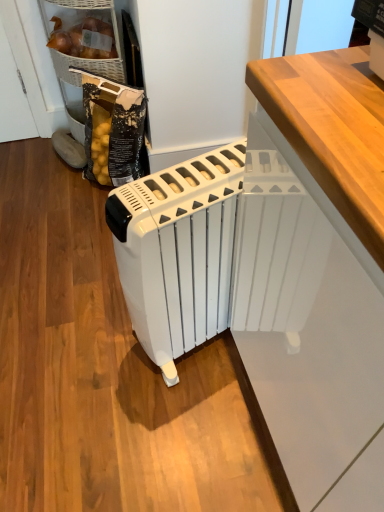
Question: From a real-world perspective, is matte wicker basket at upper left, placed as the 2th cabinetry when sorted from bottom to top, under white glossy radiator at center, the first cabinetry viewed from the front?

Choices:
 (A) yes
 (B) no

Answer: (B)

Question: Does matte wicker basket at upper left, acting as the first cabinetry starting from the top, lie in front of white glossy radiator at center, the 2th cabinetry from the back?

Choices:
 (A) yes
 (B) no

Answer: (B)

Question: From a real-world perspective, is matte wicker basket at upper left, the 2th cabinetry when ordered from front to back, on top of white glossy radiator at center, which is the first cabinetry from bottom to top?

Choices:
 (A) no
 (B) yes

Answer: (B)

Question: Is there a large distance between matte wicker basket at upper left, the 2th cabinetry when ordered from front to back, and white glossy radiator at center, which ranks as the 2th cabinetry in left-to-right order?

Choices:
 (A) no
 (B) yes

Answer: (B)

Question: Is matte wicker basket at upper left, placed as the 2th cabinetry when sorted from bottom to top, to the right of white glossy radiator at center, which ranks as the 2th cabinetry in left-to-right order, from the viewer's perspective?

Choices:
 (A) no
 (B) yes

Answer: (A)

Question: Is matte wicker basket at upper left, acting as the first cabinetry starting from the top, outside of white glossy radiator at center, the 2th cabinetry in the top-to-bottom sequence?

Choices:
 (A) no
 (B) yes

Answer: (B)

Question: Can you confirm if white glossy radiator at center, the first cabinetry when ordered from right to left, is smaller than matte wicker basket at upper left, acting as the first cabinetry starting from the top?

Choices:
 (A) yes
 (B) no

Answer: (B)

Question: Is white glossy radiator at center, which ranks as the 2th cabinetry in left-to-right order, next to matte wicker basket at upper left, the 2th cabinetry in the right-to-left sequence?

Choices:
 (A) no
 (B) yes

Answer: (A)

Question: Are white glossy radiator at center, the 2th cabinetry in the top-to-bottom sequence, and matte wicker basket at upper left, placed as the 2th cabinetry when sorted from bottom to top, located far from each other?

Choices:
 (A) no
 (B) yes

Answer: (B)

Question: Can you confirm if white glossy radiator at center, which is the first cabinetry from bottom to top, is taller than matte wicker basket at upper left, the 2th cabinetry when ordered from front to back?

Choices:
 (A) no
 (B) yes

Answer: (B)

Question: Does white glossy radiator at center, the first cabinetry when ordered from right to left, turn towards matte wicker basket at upper left, acting as the first cabinetry starting from the top?

Choices:
 (A) no
 (B) yes

Answer: (A)

Question: Considering the relative sizes of white glossy radiator at center, the first cabinetry viewed from the front, and matte wicker basket at upper left, which ranks as the 1th cabinetry in back-to-front order, in the image provided, is white glossy radiator at center, the first cabinetry viewed from the front, thinner than matte wicker basket at upper left, which ranks as the 1th cabinetry in back-to-front order,?

Choices:
 (A) no
 (B) yes

Answer: (A)

Question: From the image's perspective, is white plastic radiator at center located beneath white glossy radiator at center, the 2th cabinetry from the back?

Choices:
 (A) yes
 (B) no

Answer: (B)